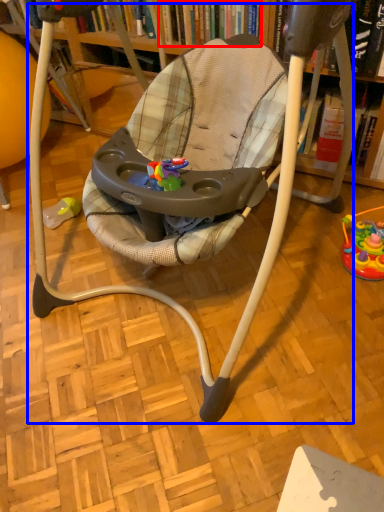
Question: Which object appears farthest to the camera in this image, book (highlighted by a red box) or baby carriage (highlighted by a blue box)?

Choices:
 (A) book
 (B) baby carriage

Answer: (A)